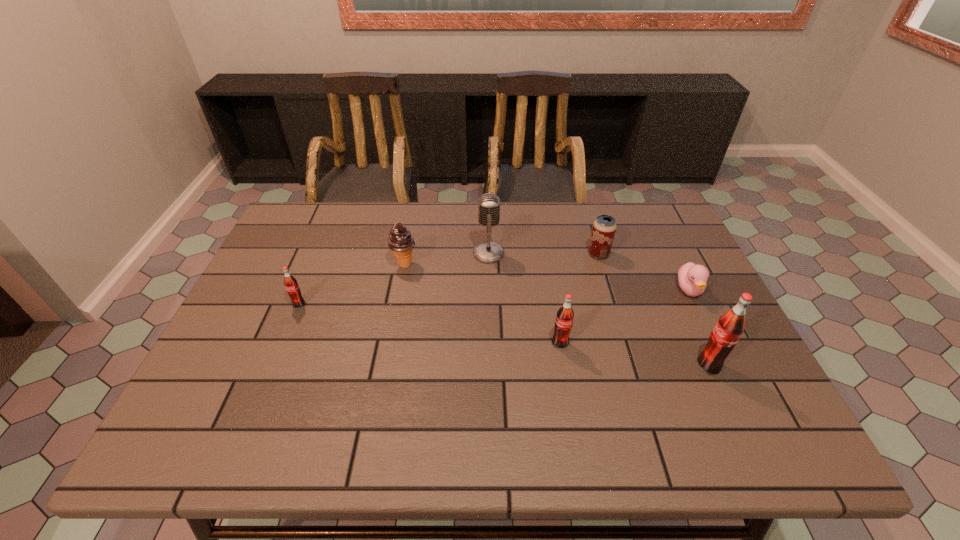
The width and height of the screenshot is (960, 540). In order to click on vacant space located 0.230m on the label of the farthest soda bottle in this screenshot , I will do `click(266, 384)`.

Locate an element on the screen. The height and width of the screenshot is (540, 960). vacant space located on the label of the sixth farthest object is located at coordinates (565, 374).

Find the location of a particular element. This screenshot has height=540, width=960. vacant space positioned on the label of the tallest soda bottle is located at coordinates (645, 365).

You are a GUI agent. You are given a task and a screenshot of the screen. Output one action in this format:
    pyautogui.click(x=<x>, y=<y>)
    Task: Click on the vacant point located 0.140m on the label of the tallest soda bottle
    The width and height of the screenshot is (960, 540).
    Given the screenshot: What is the action you would take?
    pyautogui.click(x=636, y=365)

I want to click on vacant space situated 0.190m on the label of the tallest soda bottle, so click(x=615, y=365).

Image resolution: width=960 pixels, height=540 pixels. Find the location of `free space located on the left of the beer can`. free space located on the left of the beer can is located at coordinates (520, 254).

Find the location of a particular element. Image resolution: width=960 pixels, height=540 pixels. vacant space located 0.330m on the left of the fifth object from right to left is located at coordinates (362, 254).

Where is `blank space located 0.280m on the left of the sixth object from right to left`? This screenshot has width=960, height=540. blank space located 0.280m on the left of the sixth object from right to left is located at coordinates (295, 265).

The image size is (960, 540). Identify the location of vacant area located on the front-facing side of the shortest object. (733, 380).

In order to click on beer can present at the far edge in this screenshot , I will do (604, 227).